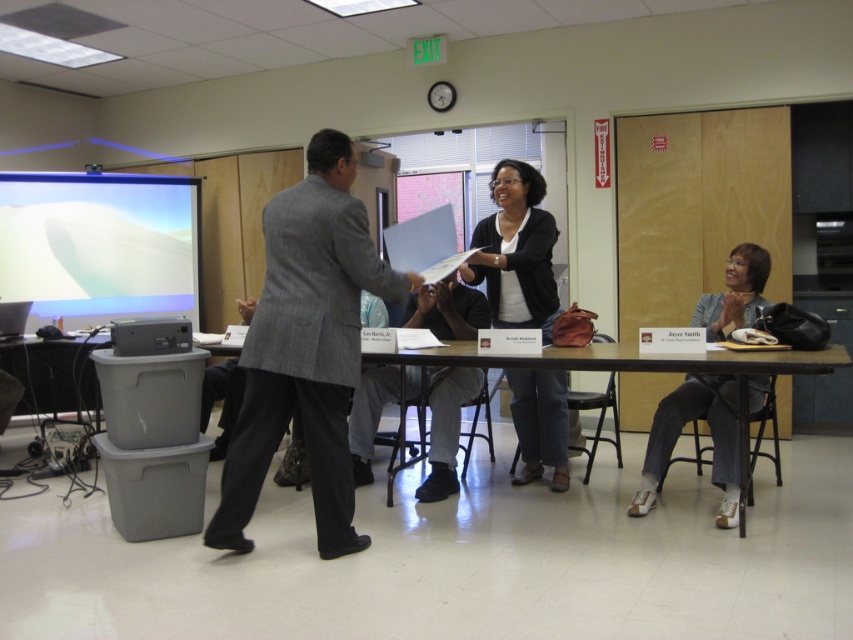
Question: Can you confirm if gray textured suit at center is positioned below denim jeans at lower right?

Choices:
 (A) yes
 (B) no

Answer: (B)

Question: Based on their relative distances, which object is nearer to the denim jeans at lower right?

Choices:
 (A) wooden table at center
 (B) matte black sweater at center
 (C) white matte projection screen at upper left

Answer: (A)

Question: Among these objects, which one is nearest to the camera?

Choices:
 (A) gray textured suit at center
 (B) matte black sweater at center
 (C) wooden table at center

Answer: (A)

Question: Can you confirm if gray textured suit at center is smaller than wooden table at center?

Choices:
 (A) yes
 (B) no

Answer: (A)

Question: Which of these objects is positioned farthest from the matte black sweater at center?

Choices:
 (A) wooden table at center
 (B) denim jeans at lower right
 (C) gray textured suit at center

Answer: (C)

Question: Does gray textured suit at center have a smaller size compared to wooden table at center?

Choices:
 (A) yes
 (B) no

Answer: (A)